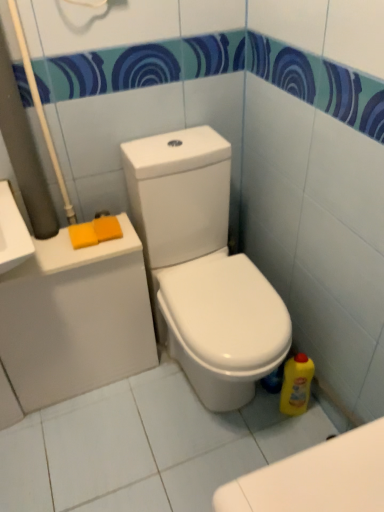
What are the coordinates of `vacant area situated to the left side of orange sponge at upper left, which is the second soap in left-to-right order` in the screenshot? It's located at (54, 246).